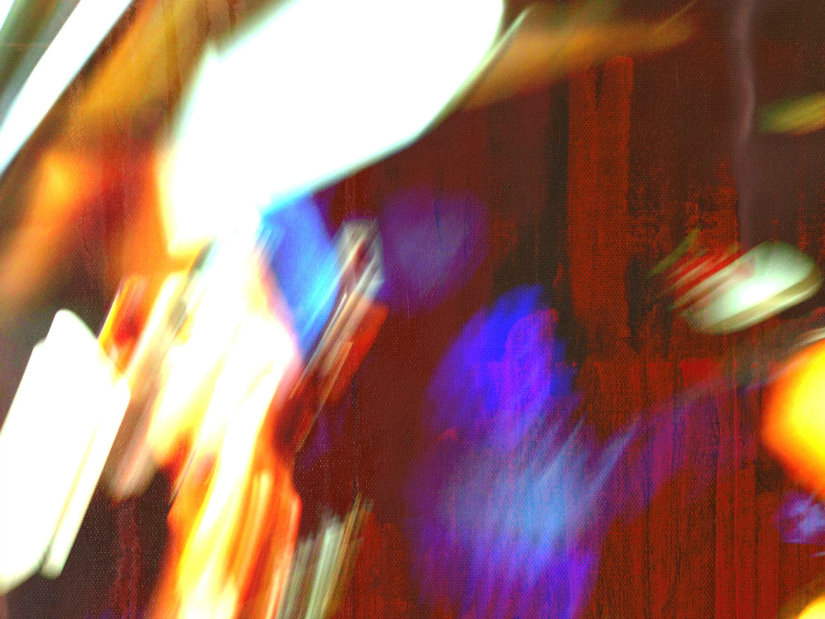
Where is `orange light`? This screenshot has width=825, height=619. orange light is located at coordinates (799, 412).